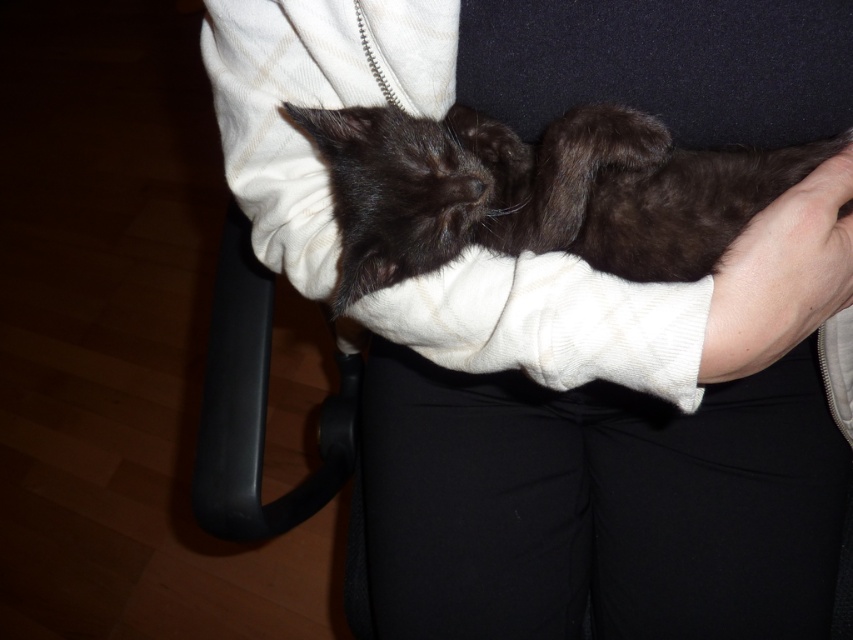
You are a photographer trying to capture a close shot of the black plastic armrest at lower left and the smooth skin at lower right. Since your camera can only focus on one object at a time, which object should you choose to ensure it fills more of the frame?

The black plastic armrest at lower left has a larger size compared to the smooth skin at lower right, so you should choose the black plastic armrest at lower left to fill more of the frame.

You are a photographer trying to capture the black fluffy cat at center in the image. To ensure the cat is centered in your photo, where should you position your camera relative to the cat?

The black fluffy cat at center is already positioned at the center point of the image, so you should aim your camera directly at the cat to keep it centered.